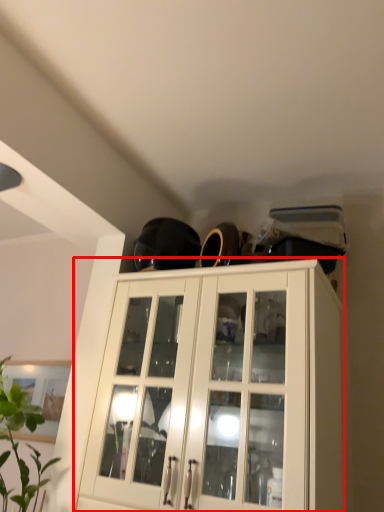
Question: Considering the relative positions of cabinetry (annotated by the red box) and houseplant in the image provided, where is cabinetry (annotated by the red box) located with respect to the staircase?

Choices:
 (A) left
 (B) right

Answer: (B)